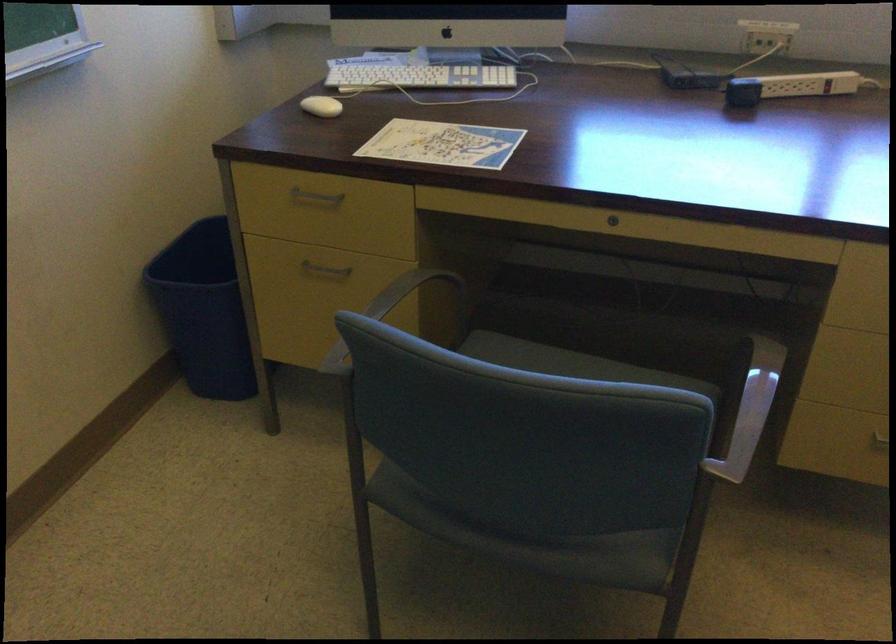
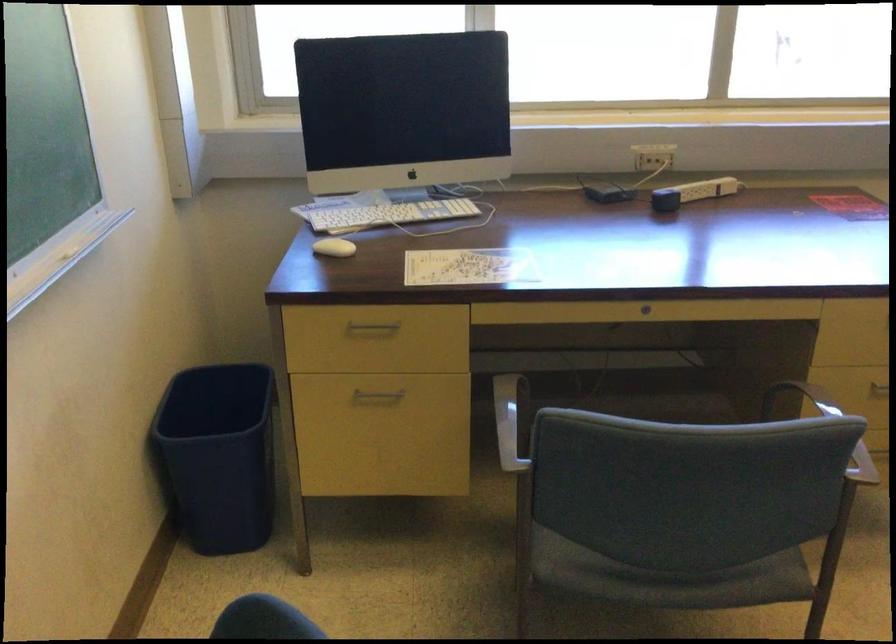
Question: The images are taken continuously from a first-person perspective. In which direction is your viewpoint rotating?

Choices:
 (A) Left
 (B) Right
 (C) Up
 (D) Down

Answer: (B)